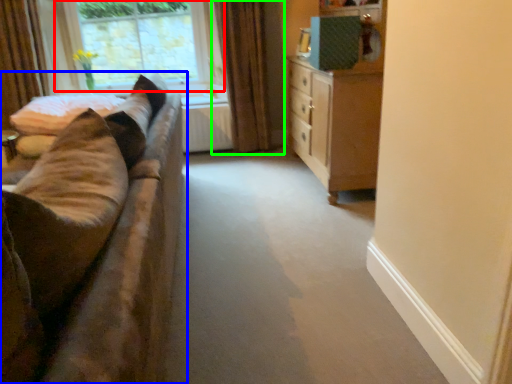
Question: Which object is positioned farthest from window (highlighted by a red box)? Select from studio couch (highlighted by a blue box) and curtain (highlighted by a green box).

Choices:
 (A) studio couch
 (B) curtain

Answer: (A)